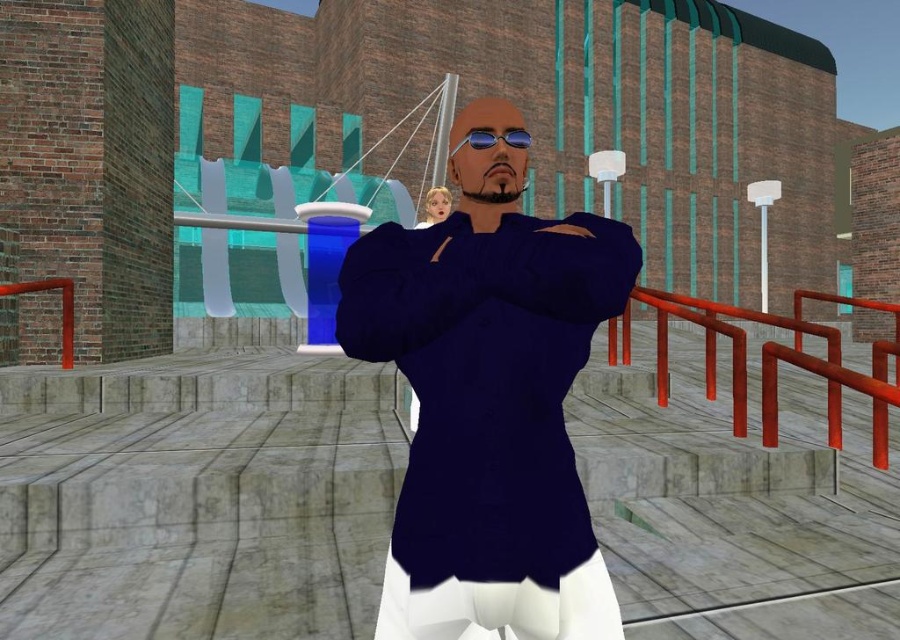
Question: Which is farther from the metallic red railing at right?

Choices:
 (A) blue reflective lenses at center
 (B) rubberized red railing at left

Answer: (B)

Question: Can you confirm if rubberized red railing at left is positioned to the left of blue reflective lenses at center?

Choices:
 (A) yes
 (B) no

Answer: (A)

Question: Which point appears closest to the camera in this image?

Choices:
 (A) (x=5, y=292)
 (B) (x=713, y=353)
 (C) (x=488, y=136)
 (D) (x=446, y=595)

Answer: (D)

Question: Is navy blue shirt at center positioned before blue reflective lenses at center?

Choices:
 (A) no
 (B) yes

Answer: (B)

Question: Which point is farther from the camera taking this photo?

Choices:
 (A) (484, 132)
 (B) (524, 396)
 (C) (714, 323)

Answer: (C)

Question: Observing the image, what is the correct spatial positioning of metallic red railing at right in reference to rubberized red railing at left?

Choices:
 (A) left
 (B) right

Answer: (B)